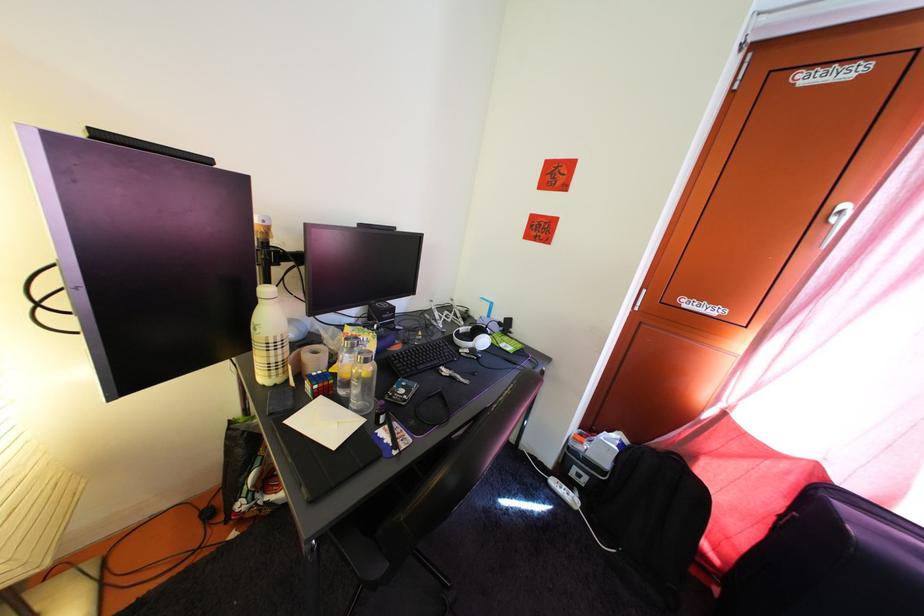
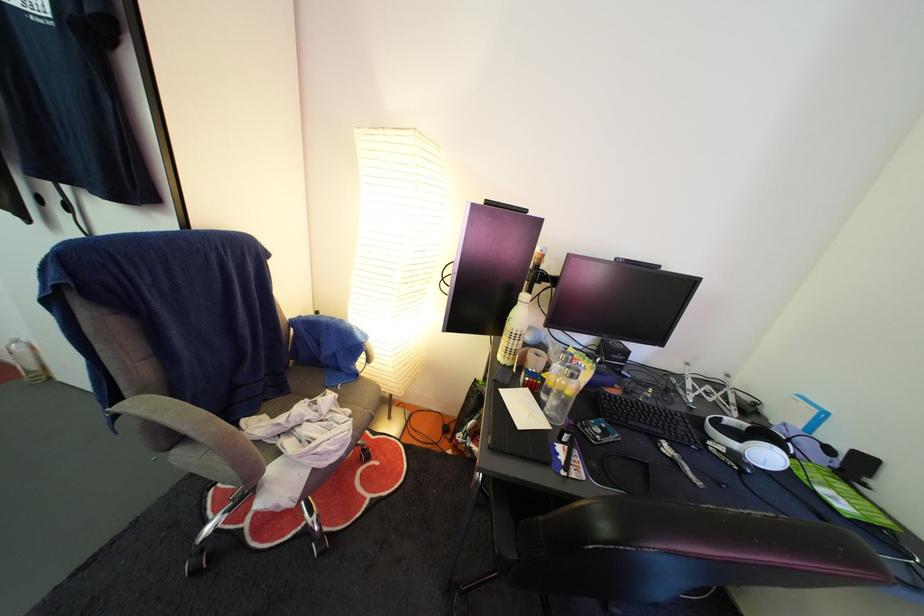
Where in the second image is the point corresponding to the point at 280,423 from the first image?

(504, 389)